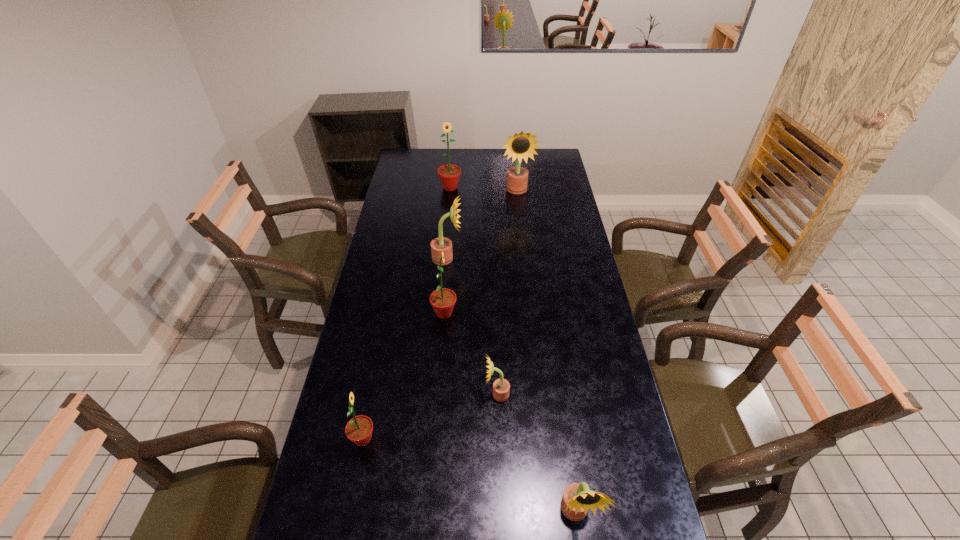
Where is `the farthest yellow sunflower`? the farthest yellow sunflower is located at coordinates (520, 146).

This screenshot has height=540, width=960. I want to click on the farthest green sunflower, so click(x=449, y=174).

Locate an element on the screen. the third farthest object is located at coordinates (439, 244).

At what (x,y) coordinates should I click in order to perform the action: click on the third smallest yellow sunflower. Please return your answer as a coordinate pair (x, y). The width and height of the screenshot is (960, 540). Looking at the image, I should click on (x=439, y=244).

The width and height of the screenshot is (960, 540). I want to click on the fourth farthest sunflower, so click(442, 300).

Identify the location of the second biggest green sunflower. (442, 300).

Locate an element on the screen. the second nearest object is located at coordinates (359, 429).

Identify the location of the leftmost object. The image size is (960, 540). (359, 429).

This screenshot has height=540, width=960. In order to click on the nearest yellow sunflower in this screenshot , I will do `click(577, 498)`.

I want to click on the second smallest yellow sunflower, so click(577, 498).